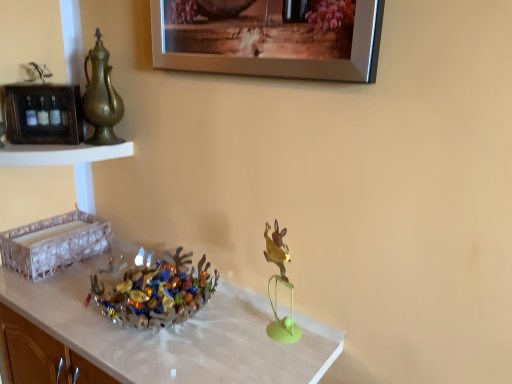
Question: Does gold metallic teapot at left come behind translucent glass tray at left, positioned as the first shelf in bottom-to-top order?

Choices:
 (A) yes
 (B) no

Answer: (B)

Question: From a real-world perspective, is gold metallic teapot at left over translucent glass tray at left, which is the 2th shelf from top to bottom?

Choices:
 (A) no
 (B) yes

Answer: (B)

Question: From the image's perspective, does gold metallic teapot at left appear lower than translucent glass tray at left, positioned as the first shelf in bottom-to-top order?

Choices:
 (A) no
 (B) yes

Answer: (A)

Question: Can you confirm if gold metallic teapot at left is smaller than translucent glass tray at left, positioned as the first shelf in bottom-to-top order?

Choices:
 (A) no
 (B) yes

Answer: (B)

Question: Is gold metallic teapot at left oriented towards translucent glass tray at left, positioned as the first shelf in bottom-to-top order?

Choices:
 (A) no
 (B) yes

Answer: (A)

Question: Considering the relative positions of wooden frame at left, the 2th shelf from the bottom, and translucent glass bowl at center in the image provided, is wooden frame at left, the 2th shelf from the bottom, to the left or to the right of translucent glass bowl at center?

Choices:
 (A) left
 (B) right

Answer: (A)

Question: Looking at their shapes, would you say wooden frame at left, which is the first shelf in top-to-bottom order, is wider or thinner than translucent glass bowl at center?

Choices:
 (A) wide
 (B) thin

Answer: (B)

Question: From a real-world perspective, relative to translucent glass bowl at center, is wooden frame at left, the 2th shelf from the bottom, vertically above or below?

Choices:
 (A) below
 (B) above

Answer: (B)

Question: Is point (52, 91) closer or farther from the camera than point (168, 334)?

Choices:
 (A) closer
 (B) farther

Answer: (B)

Question: In the image, is silver metallic picture frame at upper center on the left side or the right side of white textured tray at upper left?

Choices:
 (A) left
 (B) right

Answer: (B)

Question: Considering the positions of silver metallic picture frame at upper center and white textured tray at upper left in the image, is silver metallic picture frame at upper center wider or thinner than white textured tray at upper left?

Choices:
 (A) wide
 (B) thin

Answer: (B)

Question: In terms of size, does silver metallic picture frame at upper center appear bigger or smaller than white textured tray at upper left?

Choices:
 (A) big
 (B) small

Answer: (A)

Question: Is point (331, 4) positioned closer to the camera than point (53, 162)?

Choices:
 (A) farther
 (B) closer

Answer: (B)

Question: Is white textured tray at upper left inside or outside of silver metallic picture frame at upper center?

Choices:
 (A) inside
 (B) outside

Answer: (B)

Question: Would you say white textured tray at upper left is to the left or to the right of silver metallic picture frame at upper center in the picture?

Choices:
 (A) right
 (B) left

Answer: (B)